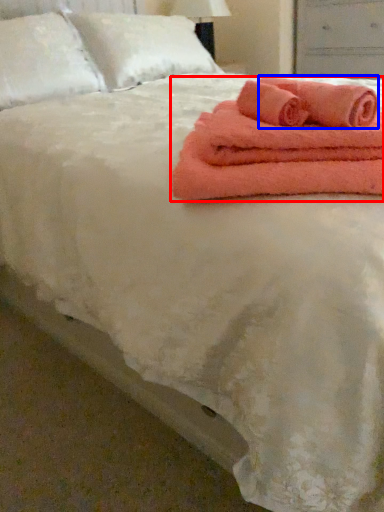
Question: Which of the following is the farthest to the observer, towel (highlighted by a red box) or bath towel (highlighted by a blue box)?

Choices:
 (A) towel
 (B) bath towel

Answer: (B)